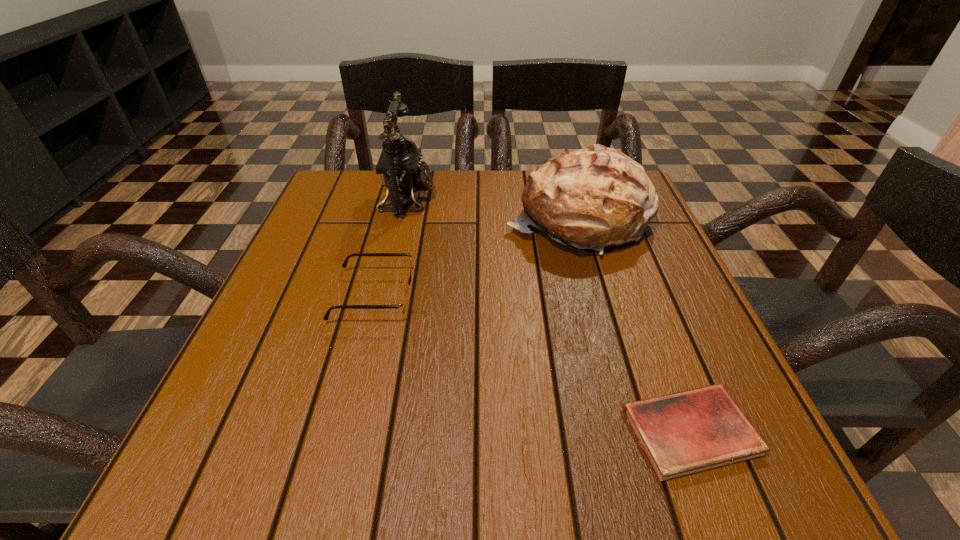
Image resolution: width=960 pixels, height=540 pixels. I want to click on telephone, so click(x=399, y=164).

At what (x,y) coordinates should I click in order to perform the action: click on the third shortest object. Please return your answer as a coordinate pair (x, y). Image resolution: width=960 pixels, height=540 pixels. Looking at the image, I should click on [591, 198].

The width and height of the screenshot is (960, 540). In order to click on the second nearest object in this screenshot , I will do pos(403,304).

Where is `spectacles`? This screenshot has width=960, height=540. spectacles is located at coordinates (403, 304).

The height and width of the screenshot is (540, 960). Identify the location of the nearest object. (683, 433).

Where is `the shortest object`? Image resolution: width=960 pixels, height=540 pixels. the shortest object is located at coordinates (683, 433).

You are a GUI agent. You are given a task and a screenshot of the screen. Output one action in this format:
    pyautogui.click(x=<x>, y=<y>)
    Task: Click on the vacant space located 0.350m on the rotary dial of the telephone
    The height and width of the screenshot is (540, 960).
    Given the screenshot: What is the action you would take?
    pyautogui.click(x=573, y=199)

Identify the location of free point located 0.370m on the front of the bread. (635, 420).

Image resolution: width=960 pixels, height=540 pixels. In order to click on vacant space situated at the hinge ends of the second nearest object in this screenshot , I will do `click(485, 295)`.

The height and width of the screenshot is (540, 960). In order to click on free location located on the left of the diary in this screenshot , I will do `click(361, 431)`.